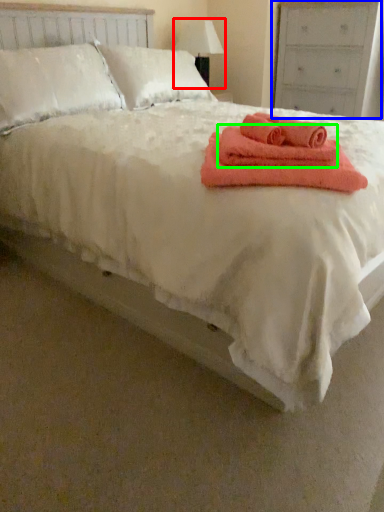
Question: Considering the real-world distances, which object is closest to table lamp (highlighted by a red box)? dresser (highlighted by a blue box) or bath towel (highlighted by a green box).

Choices:
 (A) dresser
 (B) bath towel

Answer: (A)